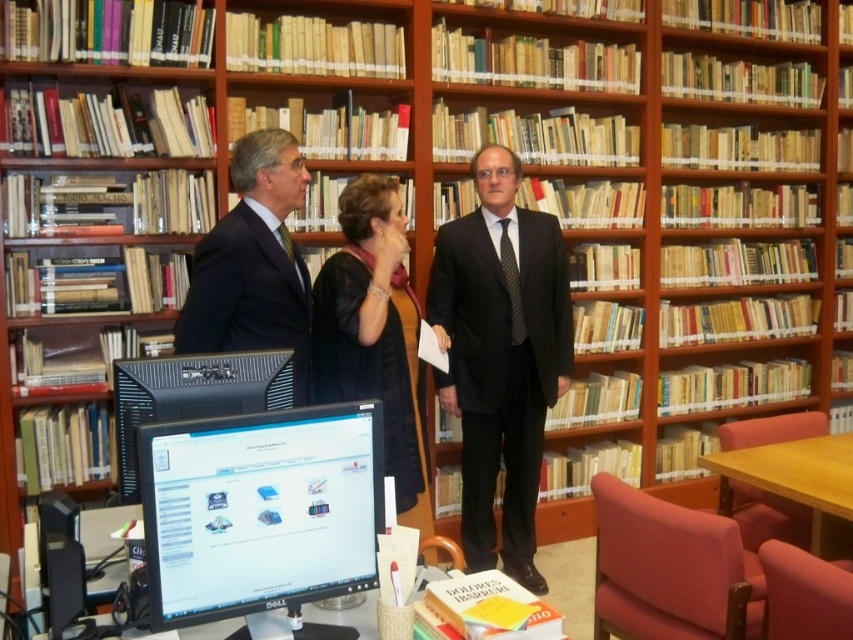
You are a librarian who needs to move a 30 inch laptop from the desk to the shelf. The desk has a matte black monitor at center and a black suit at center. Can the laptop fit between them?

The distance between the matte black monitor at center and the black suit at center is 38.14 inches, so yes, the 30 inch laptop can fit between them since the space is larger than the laptop.

You are standing in the library scene. There are two points marked in the image. The first point is at coordinates point (271, 573) and the second is at point (473, 484). Which point is closer to you?

Point (271, 573) is closer to the viewer than point (473, 484).

You are standing at the entrance of the library and see two points marked on the floor. The first point is at coordinates point (257,132) and the second is at point (456,337). Which point is closer to you?

Point (257,132) is in front of point (456,337), so it is closer to you.